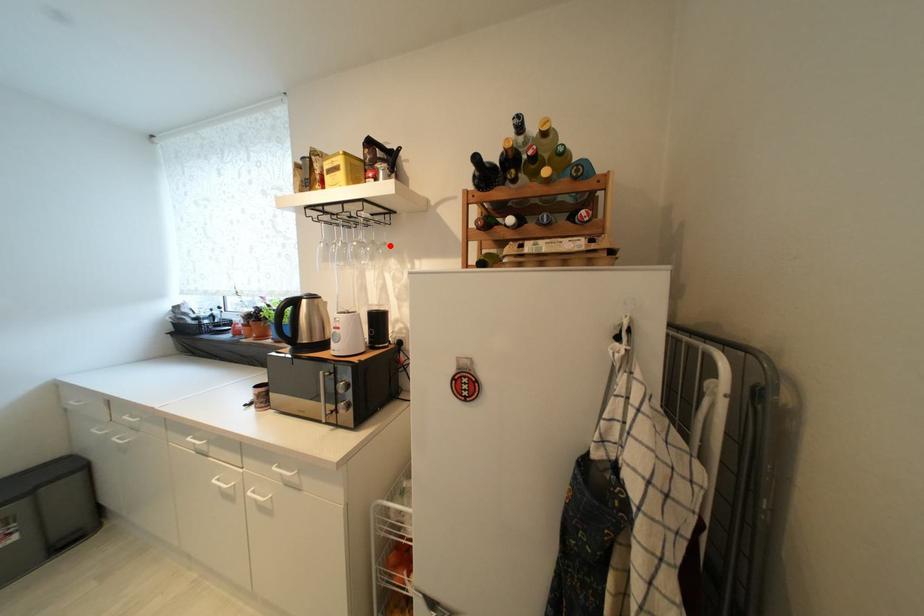
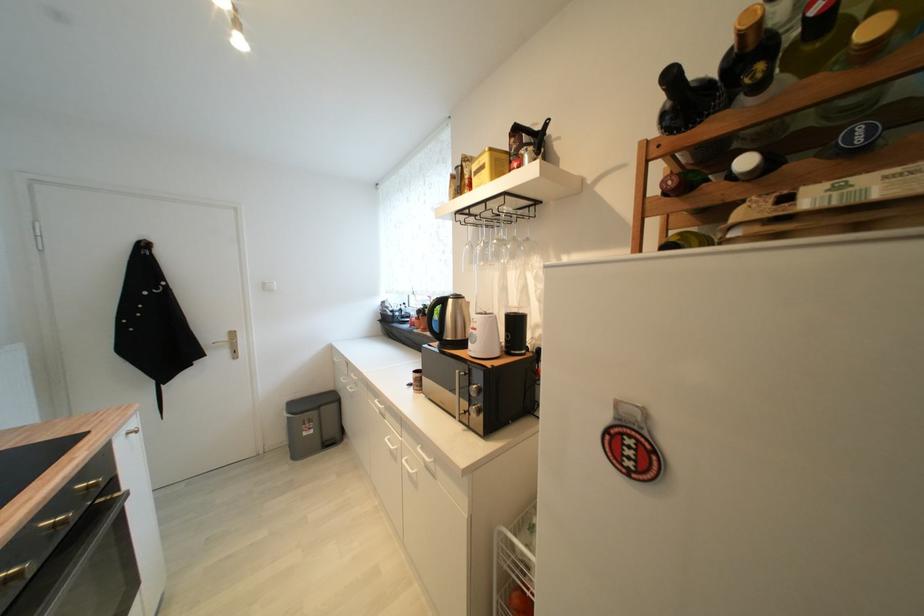
In the second image, find the point that corresponds to the highlighted location in the first image.

(532, 241)